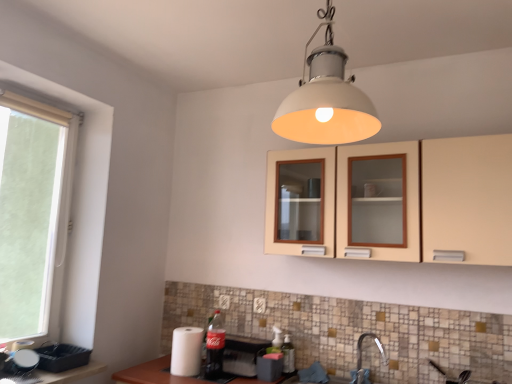
Locate an element on the screen. free space above white plastic window at left (from a real-world perspective) is located at coordinates [54, 101].